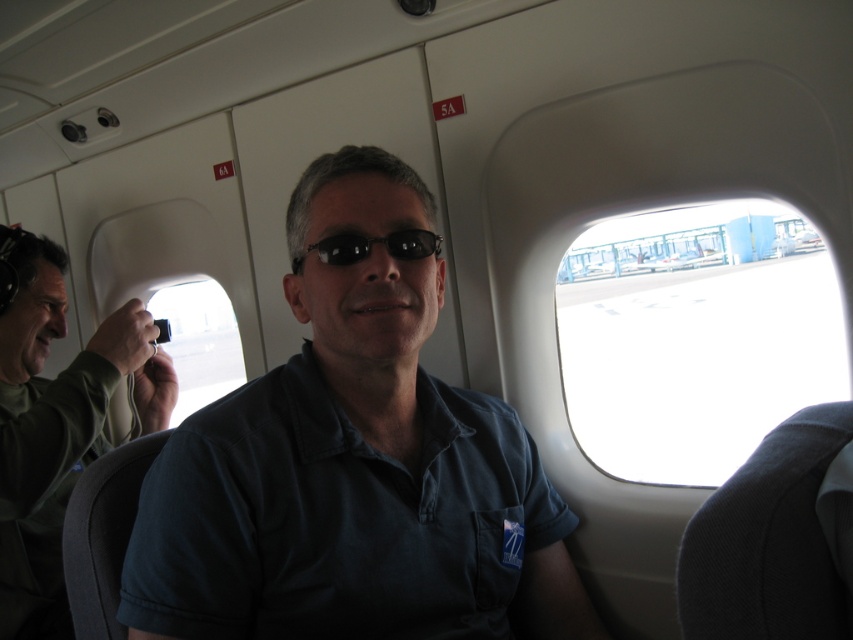
Question: Estimate the real-world distances between objects in this image. Which object is farther from the transparent glass airplane window at upper right?

Choices:
 (A) dark blue shirt at center
 (B) green matte shirt at center

Answer: (A)

Question: Which point is closer to the camera taking this photo?

Choices:
 (A) (606, 317)
 (B) (9, 426)
 (C) (299, 273)
 (D) (402, 464)

Answer: (D)

Question: Can you confirm if green matte shirt at center is positioned below black plastic sunglasses at center?

Choices:
 (A) yes
 (B) no

Answer: (A)

Question: Where is transparent glass airplane window at upper right located in relation to green matte shirt at center in the image?

Choices:
 (A) below
 (B) above

Answer: (B)

Question: Is transparent plastic airplane window at center closer to the viewer compared to black plastic sunglasses at center?

Choices:
 (A) yes
 (B) no

Answer: (B)

Question: Which object is closer to the camera taking this photo?

Choices:
 (A) dark blue shirt at center
 (B) transparent glass airplane window at upper right
 (C) black plastic sunglasses at center
 (D) transparent plastic airplane window at center

Answer: (A)